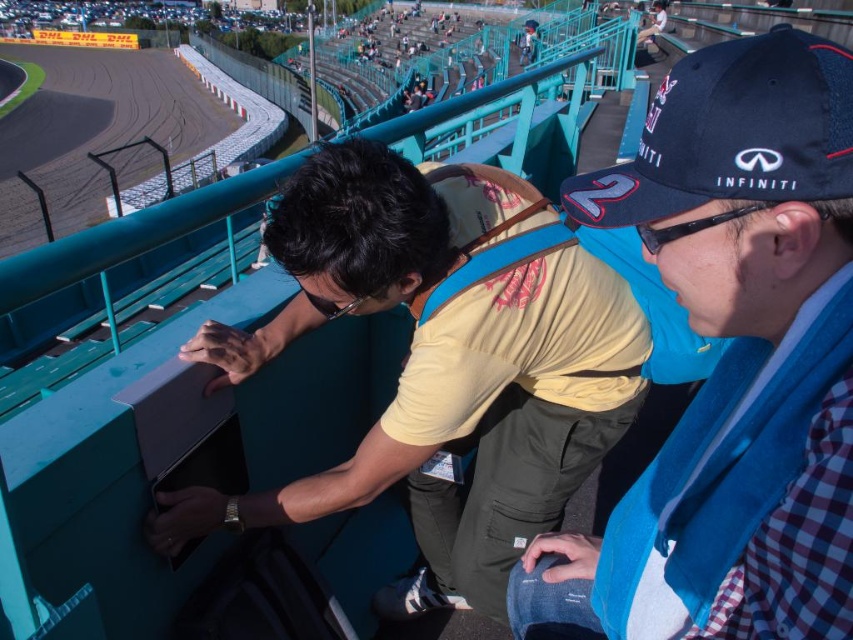
You are standing at the point marked as point (730,362) and want to retrieve the blue fabric scarf at center right. What should you do to reach it?

The blue fabric scarf at center right is located at point (730,362), so you are already at the correct location to retrieve it.